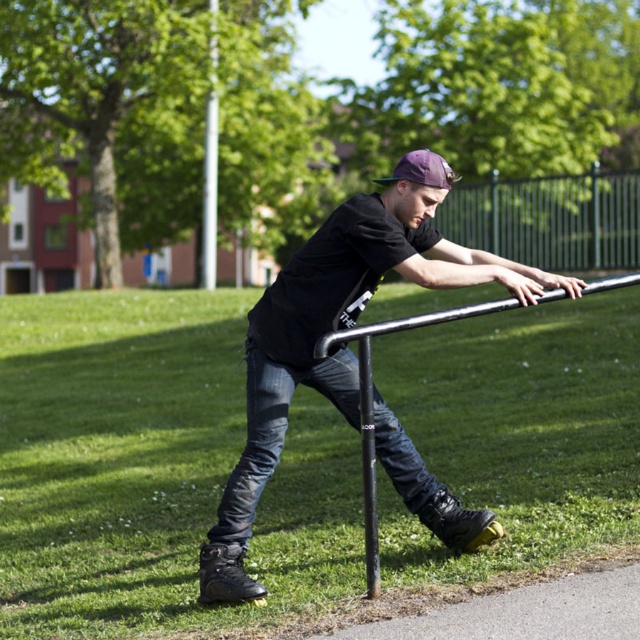
Question: Which of the following is the closest to the observer?

Choices:
 (A) (397, 435)
 (B) (637, 250)

Answer: (A)

Question: Which of the following is the closest to the observer?

Choices:
 (A) (346, 264)
 (B) (464, 236)
 (C) (365, 355)
 (D) (349, 401)

Answer: (C)

Question: Does metallic fence at upper right appear over polished metal pole at center?

Choices:
 (A) no
 (B) yes

Answer: (B)

Question: Estimate the real-world distances between objects in this image. Which object is closer to the metallic fence at upper right?

Choices:
 (A) polished metal pole at center
 (B) black matte skateboard at center
 (C) jeans at center

Answer: (B)

Question: Can you confirm if black matte skateboard at center is thinner than jeans at center?

Choices:
 (A) yes
 (B) no

Answer: (B)

Question: Is the position of metallic fence at upper right less distant than that of jeans at center?

Choices:
 (A) yes
 (B) no

Answer: (B)